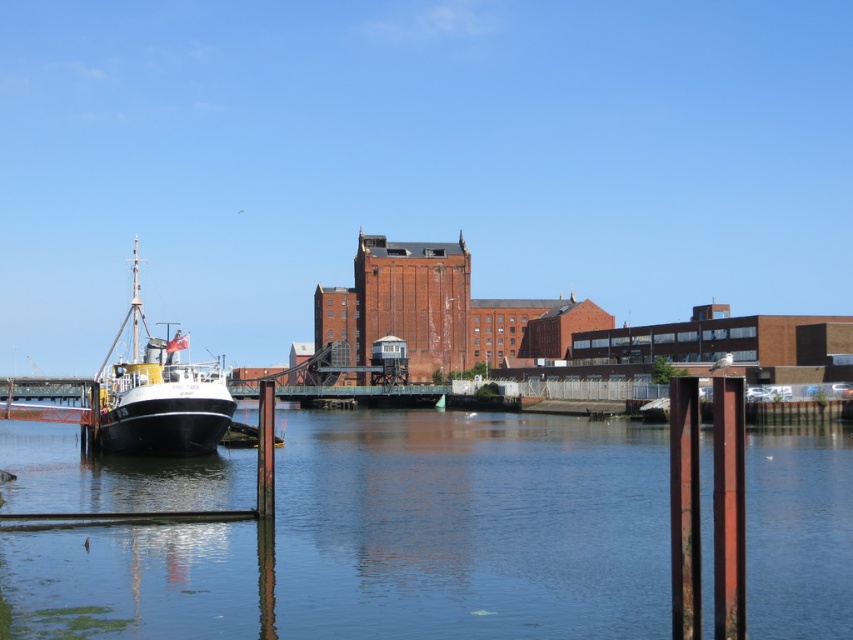
Question: Does clear blue water at center appear on the right side of polished black ship at left?

Choices:
 (A) no
 (B) yes

Answer: (B)

Question: Which point is closer to the camera?

Choices:
 (A) (134, 291)
 (B) (338, 614)

Answer: (B)

Question: Where is clear blue water at center located in relation to polished black ship at left in the image?

Choices:
 (A) above
 (B) below

Answer: (B)

Question: Can you confirm if clear blue water at center is positioned below polished black ship at left?

Choices:
 (A) no
 (B) yes

Answer: (B)